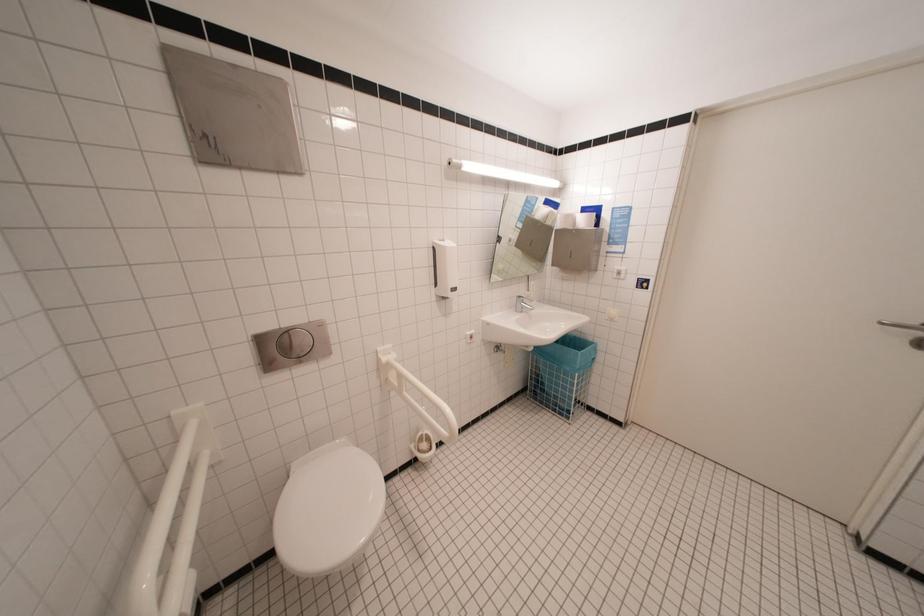
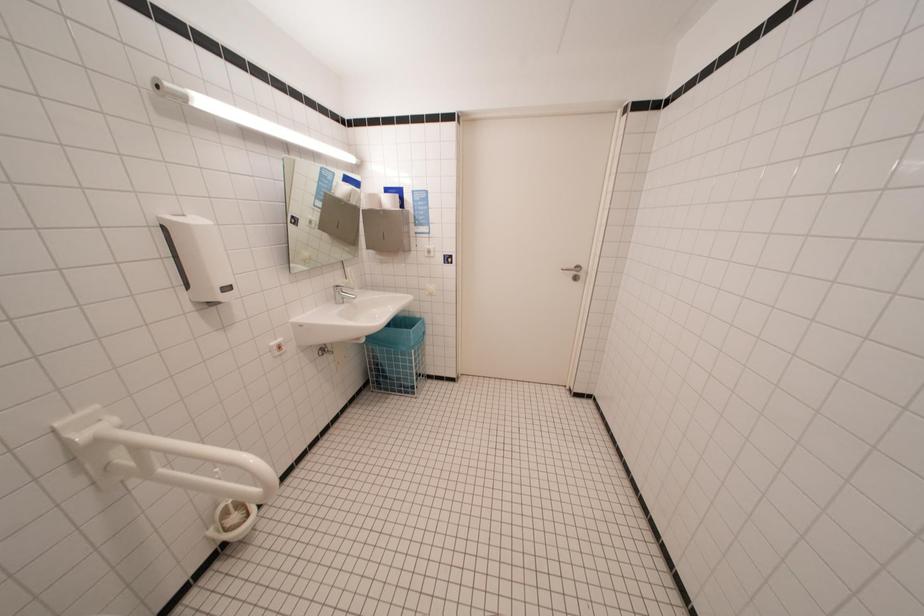
Question: The camera is either moving clockwise (left) or counter-clockwise (right) around the object. The first image is from the beginning of the video and the second image is from the end. Is the camera moving left or right when shooting the video?

Choices:
 (A) Left
 (B) Right

Answer: (A)